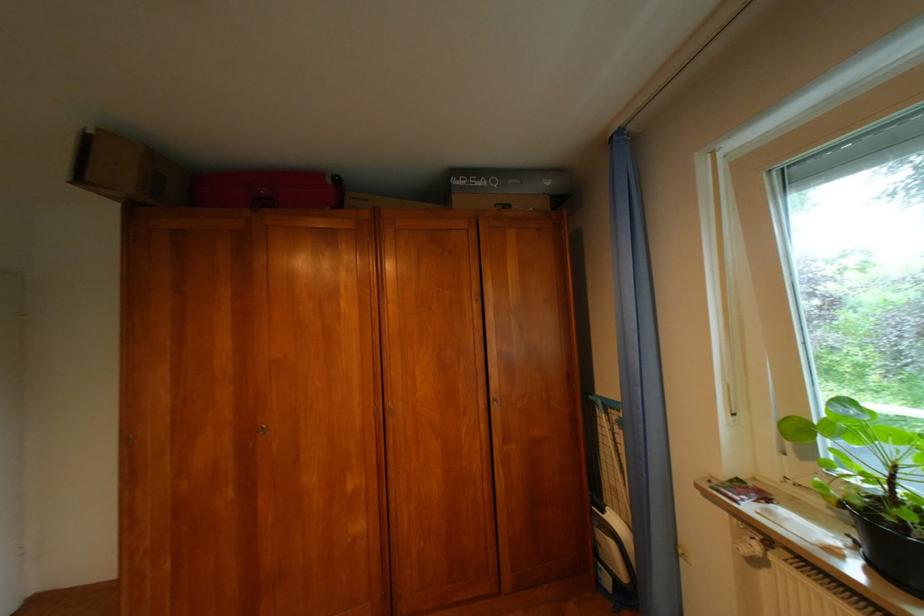
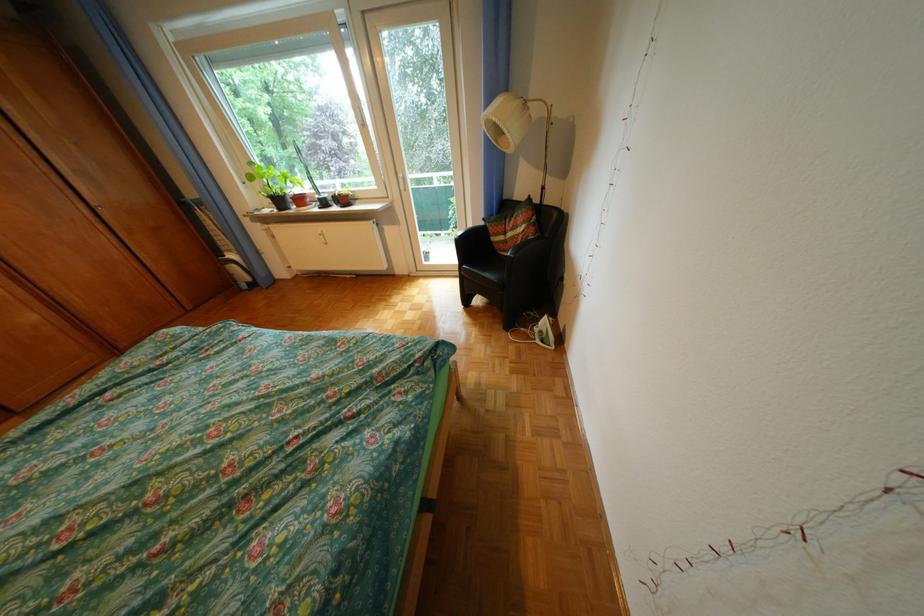
In the second image, find the point that corresponds to point (507, 397) in the first image.

(110, 205)